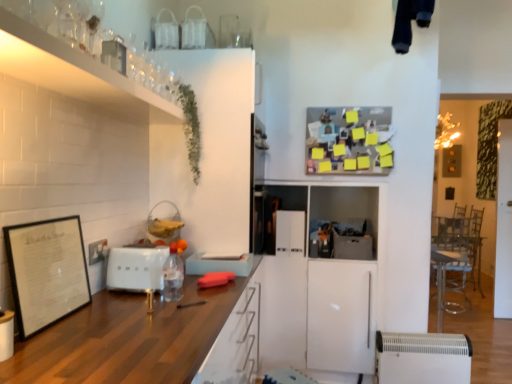
Identify the location of empty space that is ontop of white plastic heater at lower right, the 3th appliance in the back-to-front sequence (from a real-world perspective). Image resolution: width=512 pixels, height=384 pixels. (423, 336).